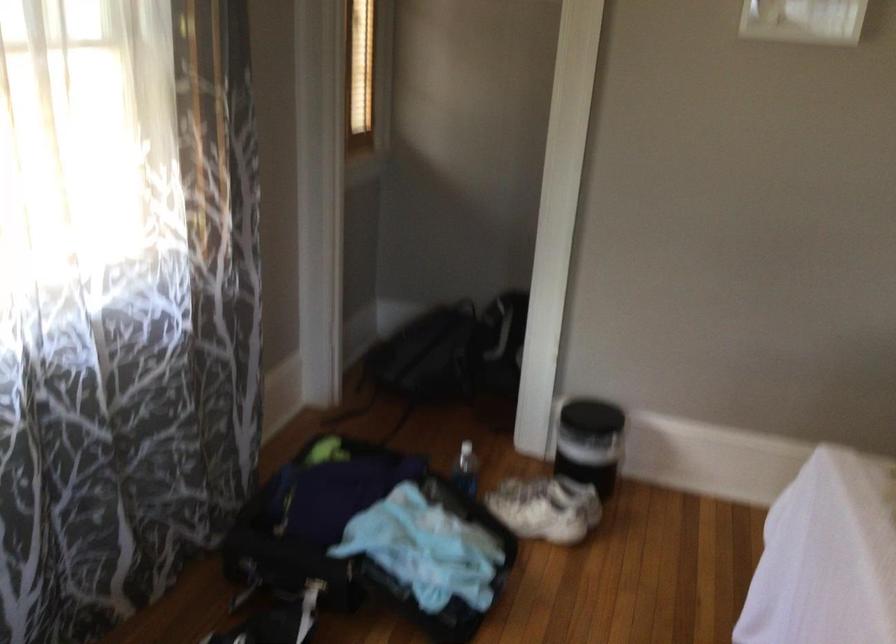
Which object does [466,469] point to?

It corresponds to the plastic water bottle in the image.